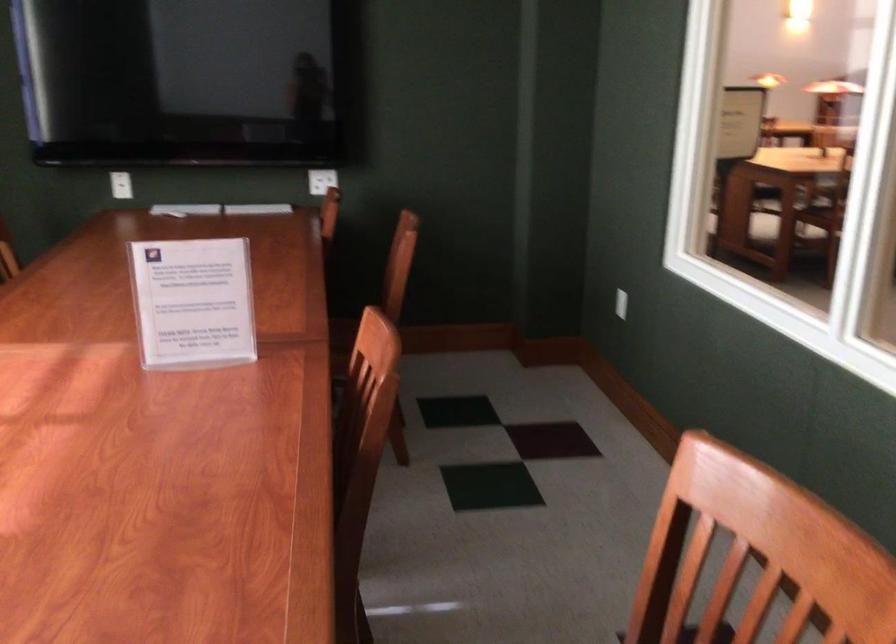
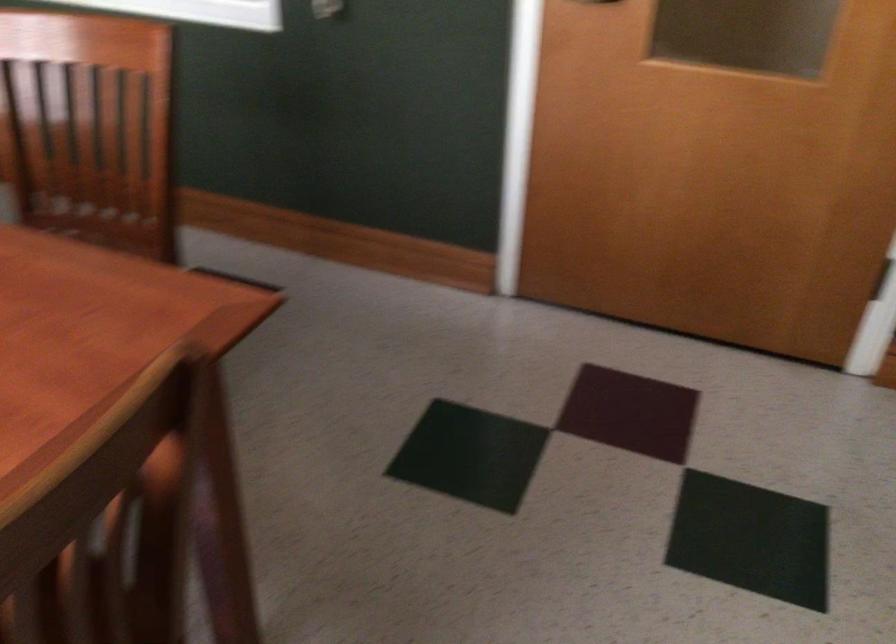
How did the camera likely rotate?

The rotation direction of the camera is right-down.